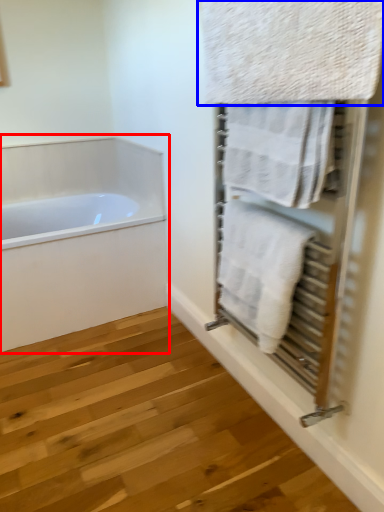
Question: Which of the following is the farthest to the observer, bathtub (highlighted by a red box) or towel (highlighted by a blue box)?

Choices:
 (A) bathtub
 (B) towel

Answer: (A)